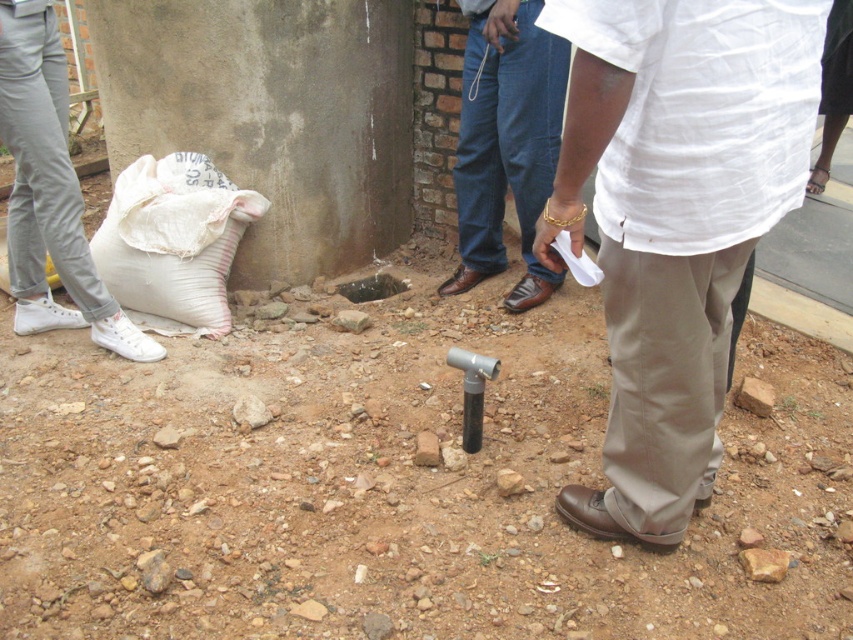
Question: Does white cotton shirt at center appear under white canvas shoe at lower left?

Choices:
 (A) yes
 (B) no

Answer: (A)

Question: Is white cotton shirt at center below white canvas shoe at lower left?

Choices:
 (A) yes
 (B) no

Answer: (A)

Question: Which point is closer to the camera?

Choices:
 (A) white canvas shoe at lower left
 (B) denim jeans at center
 (C) white cotton shirt at center

Answer: (C)

Question: Estimate the real-world distances between objects in this image. Which object is farther from the white cotton shirt at center?

Choices:
 (A) denim jeans at center
 (B) white canvas shoe at lower left

Answer: (B)

Question: Can you confirm if white cotton shirt at center is thinner than white canvas shoe at lower left?

Choices:
 (A) no
 (B) yes

Answer: (B)

Question: Which of the following is the farthest from the observer?

Choices:
 (A) (657, 48)
 (B) (514, 188)
 (C) (71, 186)

Answer: (B)